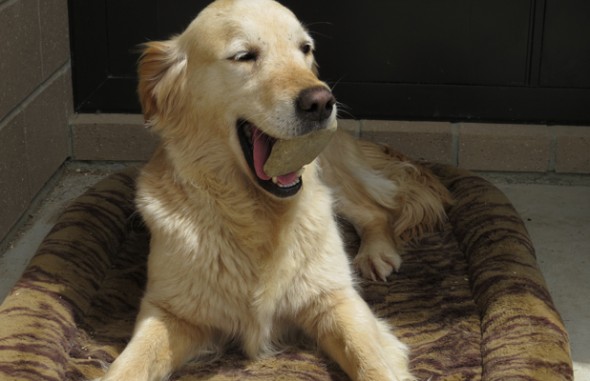
I want to click on dog bed, so click(x=77, y=321).